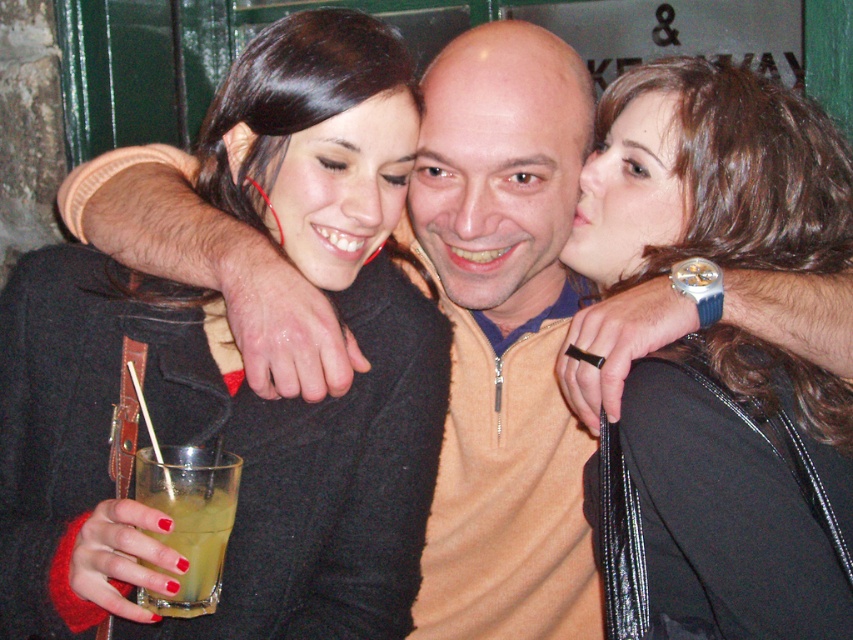
The height and width of the screenshot is (640, 853). I want to click on matte black sweater at center, so click(x=236, y=374).

Does point (762, 608) come in front of point (490, 97)?

That is True.

What do you see at coordinates (741, 486) in the screenshot? The image size is (853, 640). I see `matte black jacket at center` at bounding box center [741, 486].

Does point (811, 572) lie in front of point (453, 294)?

That is True.

Locate an element on the screen. The image size is (853, 640). matte black jacket at center is located at coordinates (741, 486).

Is matte black sweater at center wider than smooth skin face at center?

Indeed, matte black sweater at center has a greater width compared to smooth skin face at center.

Who is positioned more to the right, matte black sweater at center or smooth skin face at center?

From the viewer's perspective, smooth skin face at center appears more on the right side.

Image resolution: width=853 pixels, height=640 pixels. What do you see at coordinates (236, 374) in the screenshot? I see `matte black sweater at center` at bounding box center [236, 374].

The width and height of the screenshot is (853, 640). I want to click on matte black sweater at center, so click(236, 374).